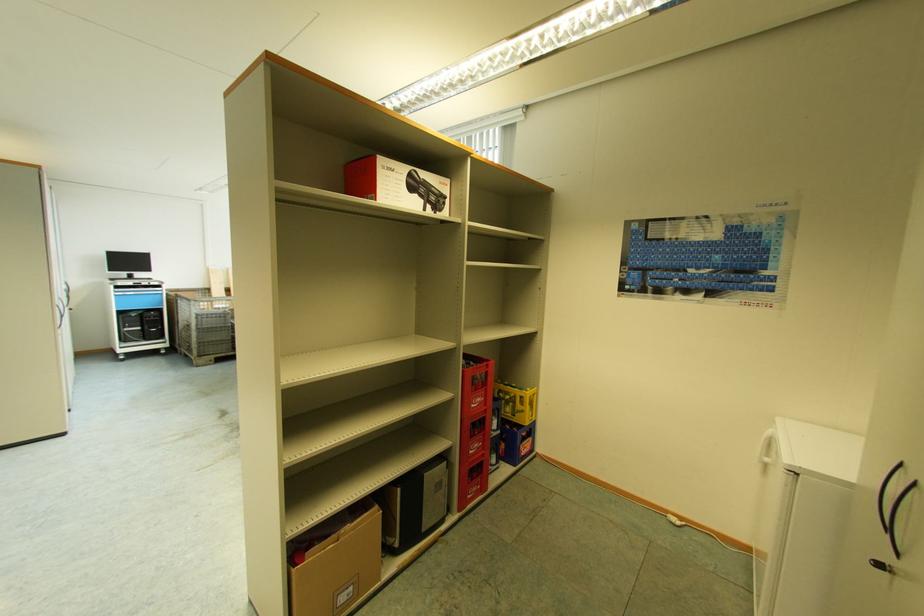
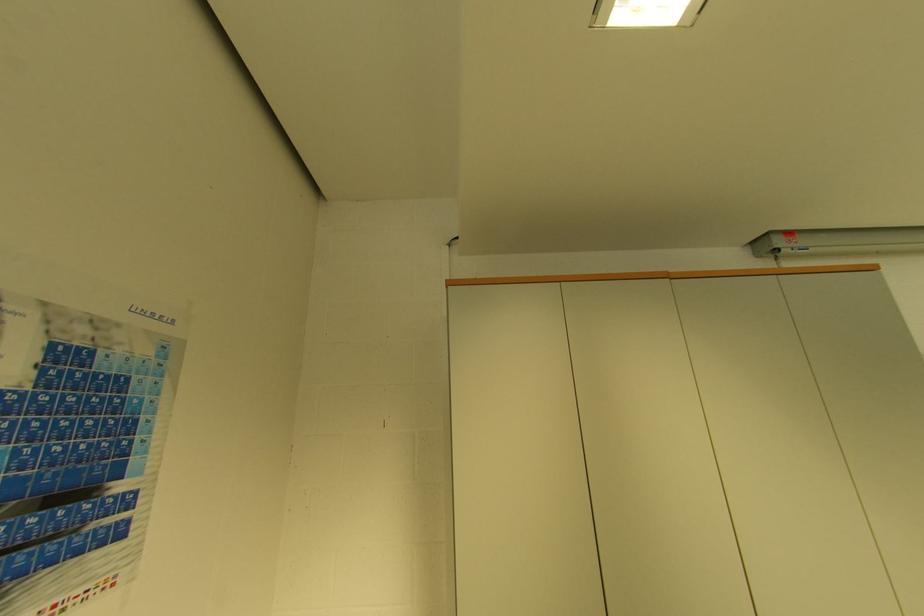
Locate, in the second image, the point that corresponds to [775,290] in the first image.

(123, 533)